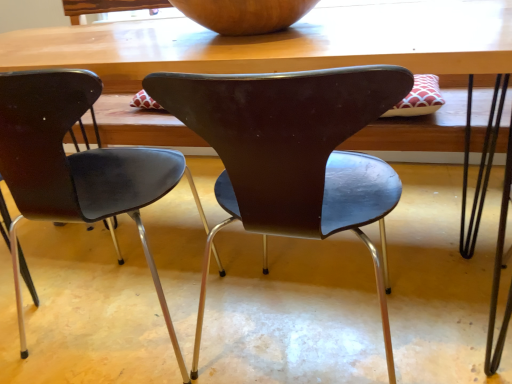
Question: Is wooden table at center oriented towards wooden bowl at upper center?

Choices:
 (A) yes
 (B) no

Answer: (B)

Question: Considering the relative sizes of wooden table at center and wooden bowl at upper center in the image provided, is wooden table at center taller than wooden bowl at upper center?

Choices:
 (A) yes
 (B) no

Answer: (A)

Question: Is wooden table at center thinner than wooden bowl at upper center?

Choices:
 (A) no
 (B) yes

Answer: (A)

Question: Are wooden table at center and wooden bowl at upper center making contact?

Choices:
 (A) yes
 (B) no

Answer: (B)

Question: Is wooden table at center outside wooden bowl at upper center?

Choices:
 (A) yes
 (B) no

Answer: (A)

Question: From a real-world perspective, relative to brown matte chair at center, the first chair when ordered from right to left, is wooden table at center vertically above or below?

Choices:
 (A) below
 (B) above

Answer: (B)

Question: Based on their positions, is wooden table at center located to the left or right of brown matte chair at center, the first chair when ordered from right to left?

Choices:
 (A) right
 (B) left

Answer: (B)

Question: Does point (157, 127) appear closer or farther from the camera than point (251, 215)?

Choices:
 (A) closer
 (B) farther

Answer: (B)

Question: In terms of width, does wooden table at center look wider or thinner when compared to brown matte chair at center, the second chair viewed from the left?

Choices:
 (A) wide
 (B) thin

Answer: (A)

Question: From their relative heights in the image, would you say brown matte chair at center, the first chair when ordered from right to left, is taller or shorter than matte black chair at center, the 2th chair in the right-to-left sequence?

Choices:
 (A) tall
 (B) short

Answer: (B)

Question: Is brown matte chair at center, the second chair viewed from the left, wider or thinner than matte black chair at center, the 2th chair in the right-to-left sequence?

Choices:
 (A) wide
 (B) thin

Answer: (B)

Question: Considering the positions of point (248, 160) and point (200, 215), is point (248, 160) closer or farther from the camera than point (200, 215)?

Choices:
 (A) closer
 (B) farther

Answer: (A)

Question: In the image, is brown matte chair at center, the first chair when ordered from right to left, on the left side or the right side of matte black chair at center, which is counted as the 1th chair, starting from the left?

Choices:
 (A) right
 (B) left

Answer: (A)

Question: Considering their positions, is wooden table at center located in front of or behind wooden bowl at upper center?

Choices:
 (A) front
 (B) behind

Answer: (A)

Question: From a real-world perspective, is wooden table at center above or below wooden bowl at upper center?

Choices:
 (A) above
 (B) below

Answer: (B)